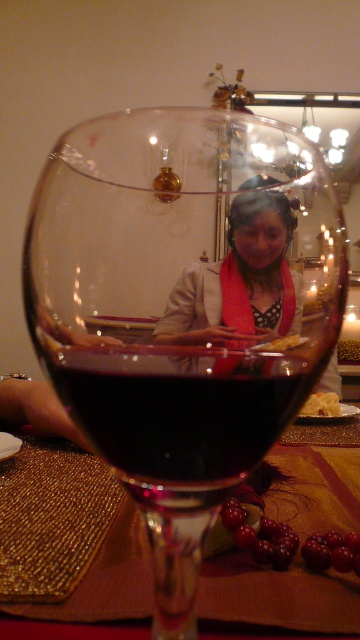
You are a bartender preparing a drink and you have a shiny dark red wine at center and a shiny gold placemat at center in front of you. Which object has a smaller width?

The shiny dark red wine at center is thinner than the shiny gold placemat at center, so the shiny dark red wine at center has a smaller width.

You are a bartender arranging items on a table. You have a shiny dark red wine at center and a shiny gold placemat at center. The customer requests that the distance between them should be exactly 8 inches. Can you adjust the placement to meet this requirement?

The current distance between the shiny dark red wine at center and the shiny gold placemat at center is 8.64 inches, which is 0.64 inches more than the required 8 inches. To meet the customer request, you should move them closer by approximately 0.64 inches.

You are a bartender trying to clean the shiny dark red wine at center and the shiny gold placemat at center. Which one should you clean first if you want to start with the object closer to you?

The shiny dark red wine at center is closer to the viewer than the shiny gold placemat at center, so you should clean the shiny dark red wine at center first.